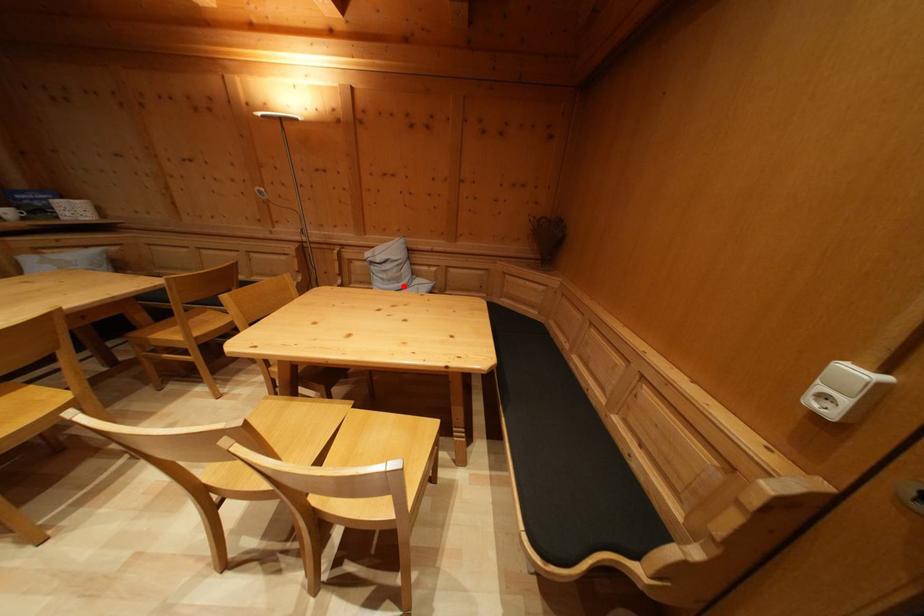
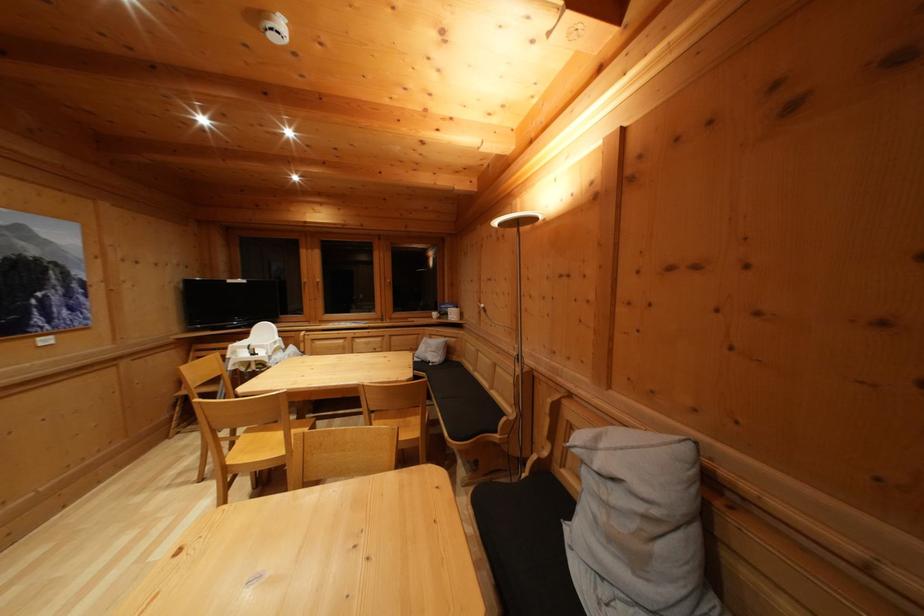
Where in the second image is the point corresponding to the highlighted location from the first image?

(640, 565)